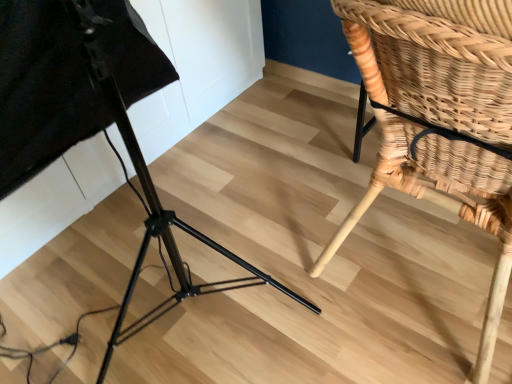
Where is `vacant space behind black metal tripod at lower left`? The image size is (512, 384). vacant space behind black metal tripod at lower left is located at coordinates (243, 146).